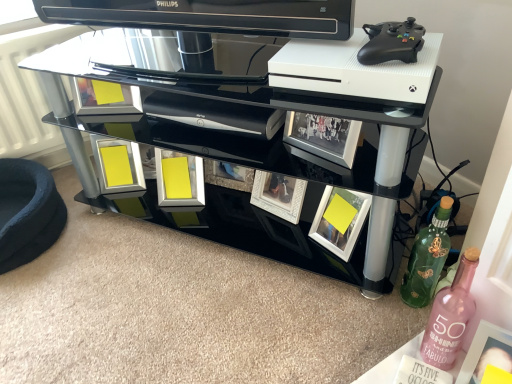
In order to click on vacant space that's between black glass tv stand at center and pink glass bottle at lower right, the 1th bottle when ordered from front to back in this screenshot , I will do `click(291, 290)`.